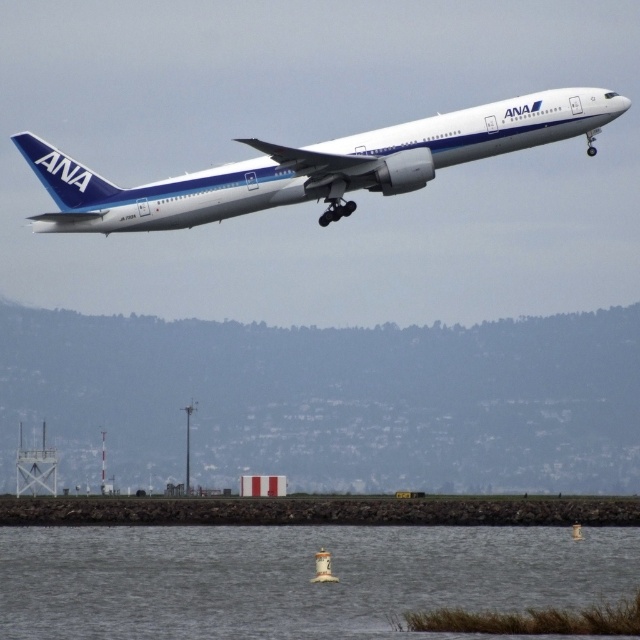
You are a pilot preparing for landing. You notice the gray water at lower center and the white metallic airplane at center in your view. Which object appears taller from your perspective?

The white metallic airplane at center appears taller than the gray water at lower center because the gray water at lower center is shorter than the white metallic airplane at center.

You are a pilot trying to navigate the ANA airplane during landing. You notice two points marked on your radar at coordinates point [285,550] and point [432,164]. Based on the scene, which point is closer to the runway?

Point [432,164] is closer to the runway because it is in front of point [285,550], which is behind it.

You are a pilot preparing to land the white metallic airplane at center. You notice the gray water at lower center ahead. Based on the spatial relationship between them, is the water likely part of the runway or a nearby body of water?

The gray water at lower center might be wider than white metallic airplane at center, suggesting it could be a body of water near the runway rather than part of the runway itself.